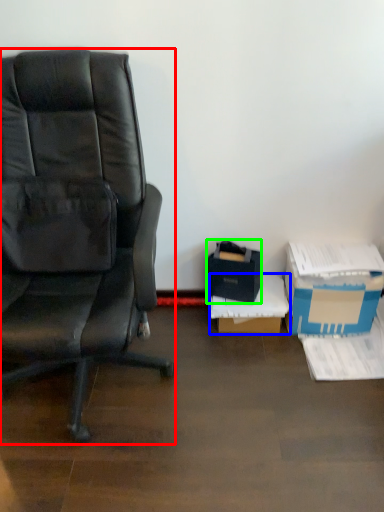
Question: Considering the real-world distances, which object is farthest from chair (highlighted by a red box)? box (highlighted by a blue box) or box (highlighted by a green box)?

Choices:
 (A) box
 (B) box

Answer: (A)